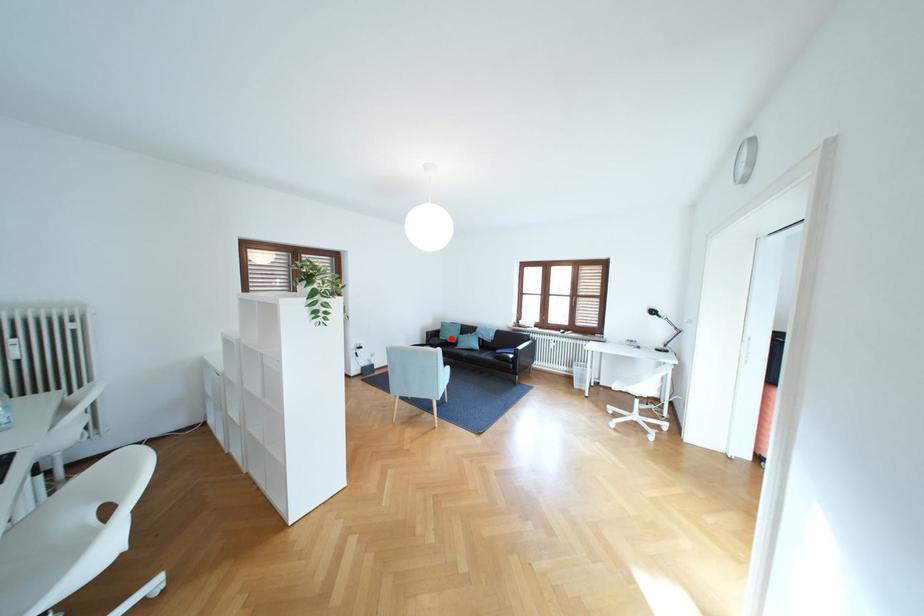
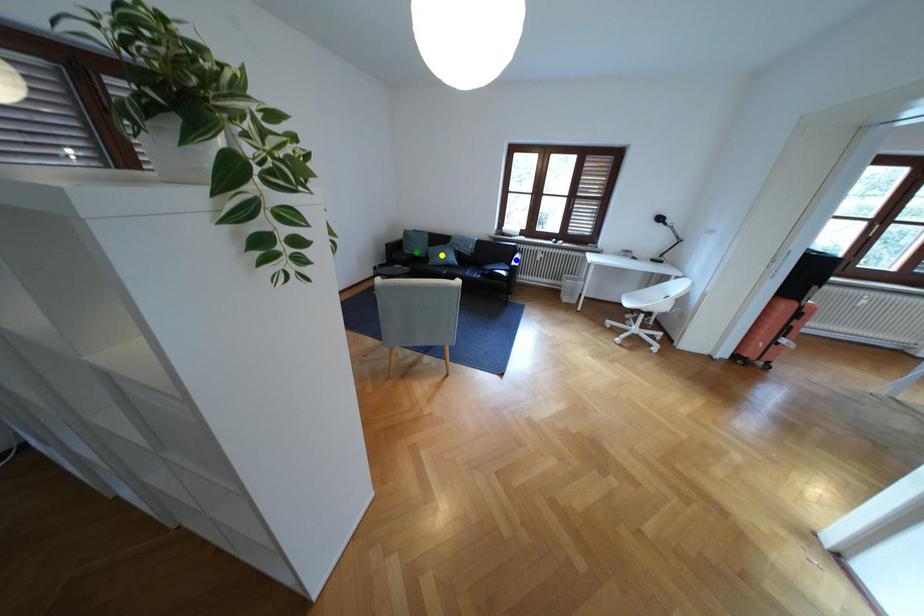
Question: I am providing you with two images of the same scene from different viewpoints. A red point is marked on the first image. You are given multiple points on the second image. Which point in image 2 represents the same 3d spot as the red point in image 1?

Choices:
 (A) yellow point
 (B) green point
 (C) blue point

Answer: (B)